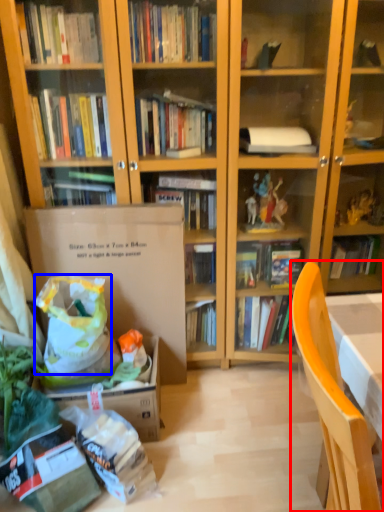
Question: Which point is closer to the camera, chair (highlighted by a red box) or grocery bag (highlighted by a blue box)?

Choices:
 (A) chair
 (B) grocery bag

Answer: (A)